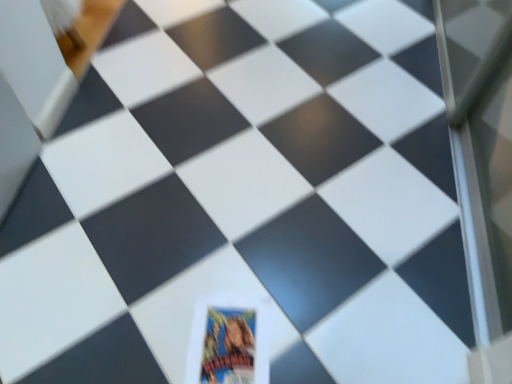
This screenshot has width=512, height=384. What are the coordinates of `colorful glossy comic book at center` in the screenshot? It's located at (228, 346).

The image size is (512, 384). What do you see at coordinates (228, 346) in the screenshot?
I see `colorful glossy comic book at center` at bounding box center [228, 346].

Measure the distance between colorful glossy comic book at center and camera.

The depth of colorful glossy comic book at center is 3.53 feet.

Find the location of a particular element. This screenshot has height=384, width=512. colorful glossy comic book at center is located at coordinates (228, 346).